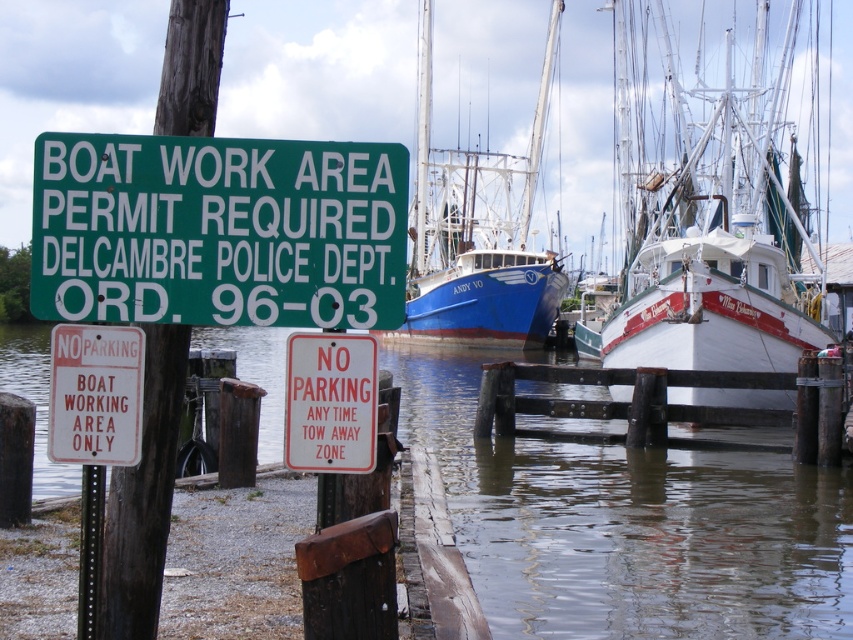
Question: Is clear water at dock center wider than white paper sign at lower left?

Choices:
 (A) no
 (B) yes

Answer: (B)

Question: Is clear water at dock center wider than blue matte boat at center?

Choices:
 (A) no
 (B) yes

Answer: (B)

Question: Estimate the real-world distances between objects in this image. Which object is closer to the white paper sign at lower left?

Choices:
 (A) green plastic sign at upper left
 (B) red plastic sign at center
 (C) clear water at dock center

Answer: (A)

Question: Which object appears farthest from the camera in this image?

Choices:
 (A) white paper sign at lower left
 (B) clear water at dock center

Answer: (A)

Question: Which point is farther to the camera?

Choices:
 (A) clear water at dock center
 (B) green plastic sign at upper left
 (C) white glossy boat at center

Answer: (C)

Question: Does blue matte boat at center appear on the right side of red plastic sign at center?

Choices:
 (A) no
 (B) yes

Answer: (B)